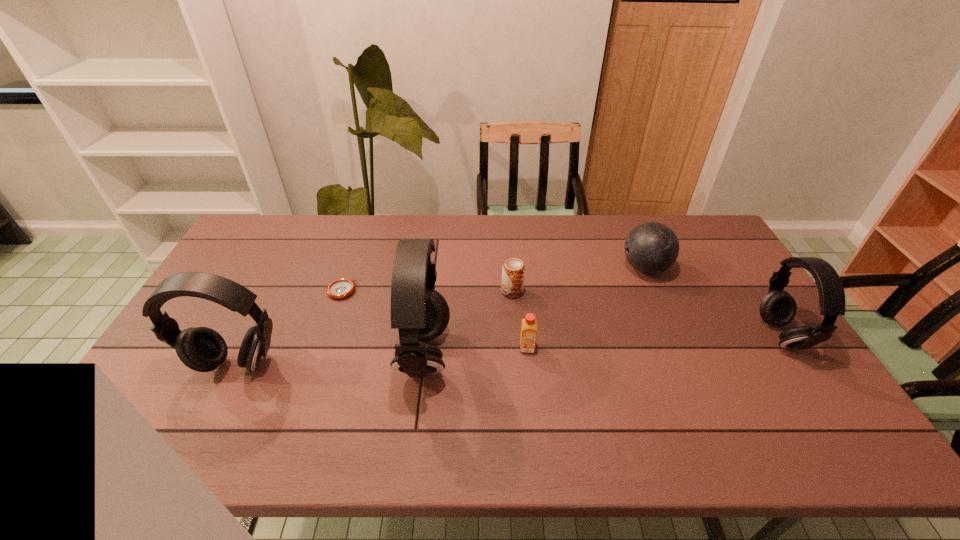
Please point a location where one more earphone can be added evenly. Please provide its 2D coordinates. Your answer should be formatted as a tuple, i.e. [(x, y)], where the tuple contains the x and y coordinates of a point satisfying the conditions above.

[(606, 344)]